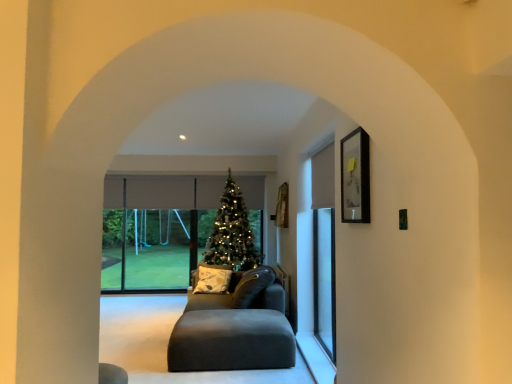
Question: Is matte gray couch at center oriented towards green matte christmas tree at center?

Choices:
 (A) yes
 (B) no

Answer: (B)

Question: Can you confirm if matte gray couch at center is positioned to the right of green matte christmas tree at center?

Choices:
 (A) no
 (B) yes

Answer: (B)

Question: From the image's perspective, is matte gray couch at center located beneath green matte christmas tree at center?

Choices:
 (A) no
 (B) yes

Answer: (B)

Question: Can you confirm if matte gray couch at center is positioned to the left of green matte christmas tree at center?

Choices:
 (A) yes
 (B) no

Answer: (B)

Question: Is matte gray couch at center positioned behind green matte christmas tree at center?

Choices:
 (A) no
 (B) yes

Answer: (A)

Question: Can you confirm if matte gray couch at center is thinner than green matte christmas tree at center?

Choices:
 (A) yes
 (B) no

Answer: (A)

Question: From the image's perspective, is matte gray couch at center located above matte black picture frame at upper right?

Choices:
 (A) no
 (B) yes

Answer: (A)

Question: Is matte gray couch at center wider than matte black picture frame at upper right?

Choices:
 (A) no
 (B) yes

Answer: (B)

Question: Is matte gray couch at center not near matte black picture frame at upper right?

Choices:
 (A) no
 (B) yes

Answer: (B)

Question: Considering the relative sizes of matte gray couch at center and matte black picture frame at upper right in the image provided, is matte gray couch at center thinner than matte black picture frame at upper right?

Choices:
 (A) no
 (B) yes

Answer: (A)

Question: From the image's perspective, does matte gray couch at center appear lower than matte black picture frame at upper right?

Choices:
 (A) no
 (B) yes

Answer: (B)

Question: Considering the relative positions of matte gray couch at center and matte black picture frame at upper right in the image provided, is matte gray couch at center to the right of matte black picture frame at upper right from the viewer's perspective?

Choices:
 (A) no
 (B) yes

Answer: (A)

Question: Does matte black picture frame at upper right come behind yellow-green printed cushion at center?

Choices:
 (A) yes
 (B) no

Answer: (B)